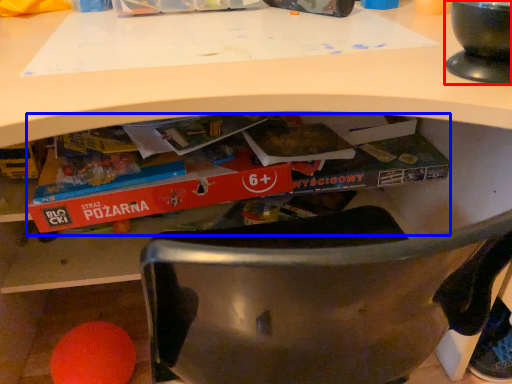
Question: Which object is closer to the camera taking this photo, appliance (highlighted by a red box) or paperback book (highlighted by a blue box)?

Choices:
 (A) appliance
 (B) paperback book

Answer: (A)